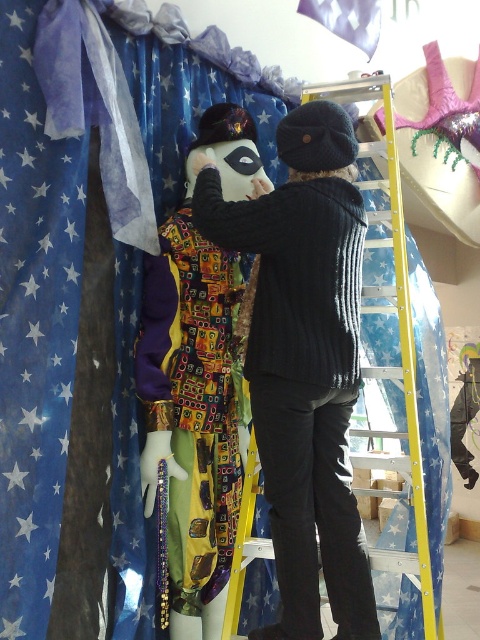
How far apart are blue star-patterned fabric at upper left and black knitted sweater at center?

blue star-patterned fabric at upper left is 17.02 inches from black knitted sweater at center.

Can you confirm if blue star-patterned fabric at upper left is taller than black knitted sweater at center?

Indeed, blue star-patterned fabric at upper left has a greater height compared to black knitted sweater at center.

Who is more forward, (158, 134) or (334, 449)?

Point (334, 449)

Locate an element on the screen. blue star-patterned fabric at upper left is located at coordinates (66, 364).

Does blue star-patterned fabric at upper left have a greater width compared to matte black mask at center?

Indeed, blue star-patterned fabric at upper left has a greater width compared to matte black mask at center.

Does point (156, 67) come closer to viewer compared to point (192, 538)?

No, (156, 67) is further to viewer.

I want to click on blue star-patterned fabric at upper left, so click(66, 364).

The image size is (480, 640). Find the location of `blue star-patterned fabric at upper left`. blue star-patterned fabric at upper left is located at coordinates (66, 364).

Can you confirm if blue star-patterned fabric at upper left is smaller than white satin flag at upper center?

No.

Where is `blue star-patterned fabric at upper left`? The image size is (480, 640). blue star-patterned fabric at upper left is located at coordinates (66, 364).